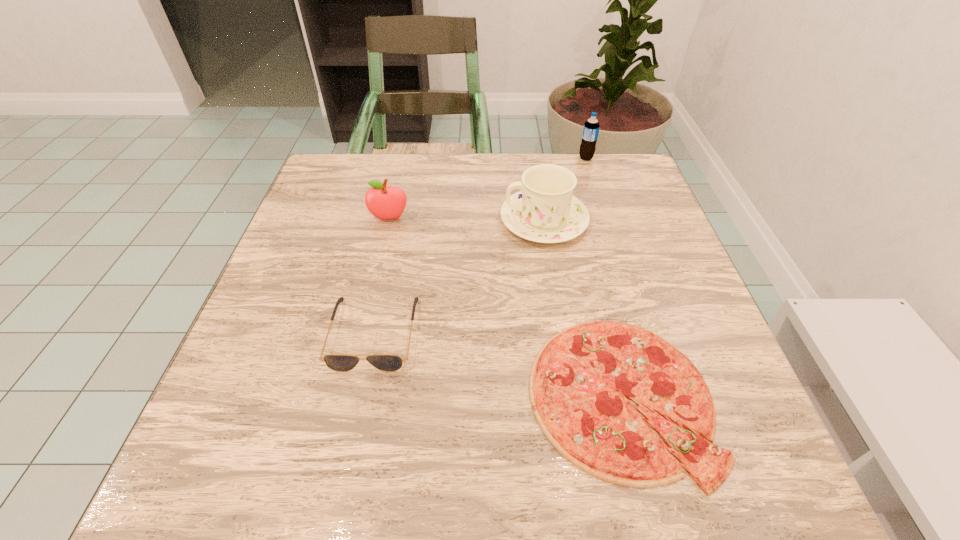
Identify the location of the farthest object. This screenshot has height=540, width=960. (x=591, y=127).

The width and height of the screenshot is (960, 540). I want to click on chinaware, so click(545, 211).

In order to click on apple in this screenshot , I will do `click(383, 202)`.

This screenshot has width=960, height=540. Identify the location of the fourth tallest object. (338, 362).

At what (x,y) coordinates should I click in order to perform the action: click on the shortest object. Please return your answer as a coordinate pair (x, y). Looking at the image, I should click on (579, 383).

Find the location of `vacant area situated 0.080m on the front of the farthest object`. vacant area situated 0.080m on the front of the farthest object is located at coordinates (592, 179).

Where is `blank space located on the handle side of the chinaware`? The width and height of the screenshot is (960, 540). blank space located on the handle side of the chinaware is located at coordinates (396, 220).

The image size is (960, 540). Identify the location of vacant point located 0.140m on the handle side of the chinaware. (440, 220).

This screenshot has height=540, width=960. I want to click on free space located 0.210m on the handle side of the chinaware, so click(x=409, y=220).

Where is `free space located on the front of the apple`? The image size is (960, 540). free space located on the front of the apple is located at coordinates (381, 254).